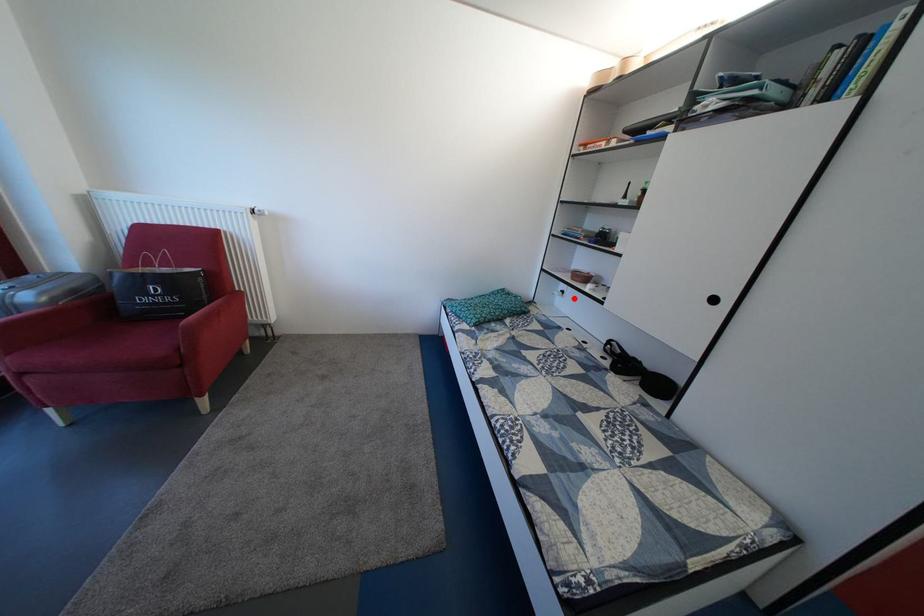
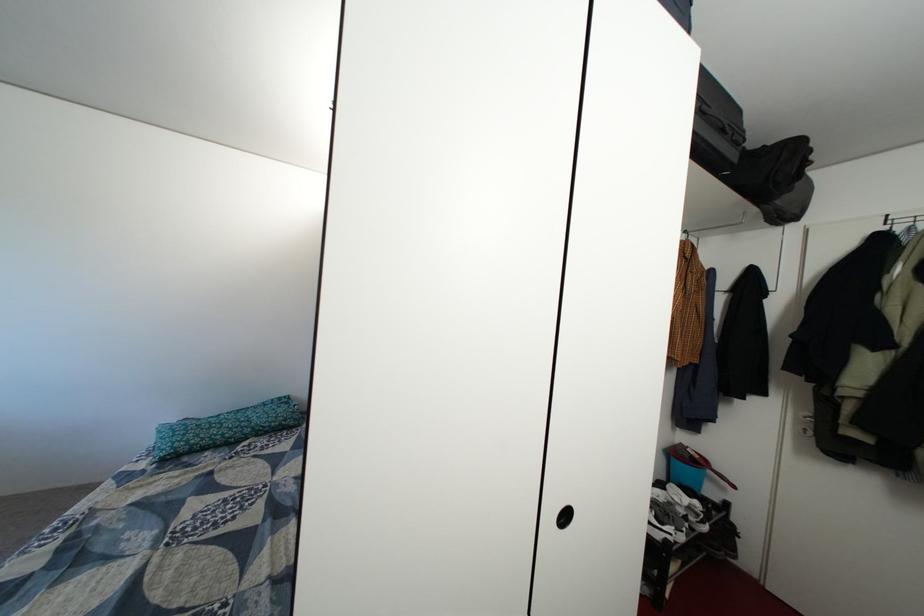
Question: I am providing you with two images of the same scene from different viewpoints. A red point is marked on the first image. Can you still see the location of the red point in image 2?

Choices:
 (A) Yes
 (B) No

Answer: (B)